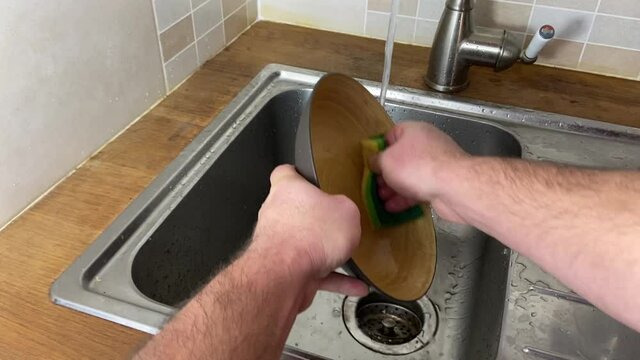
The image size is (640, 360). I want to click on tile wall at top of image, so click(595, 36).